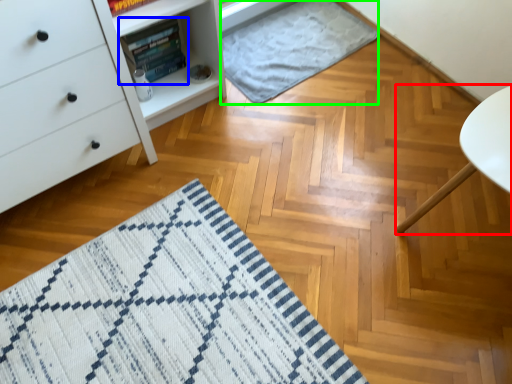
Question: Which object is positioned closest to furniture (highlighted by a red box)? Select from book (highlighted by a blue box) and blanket (highlighted by a green box).

Choices:
 (A) book
 (B) blanket

Answer: (B)